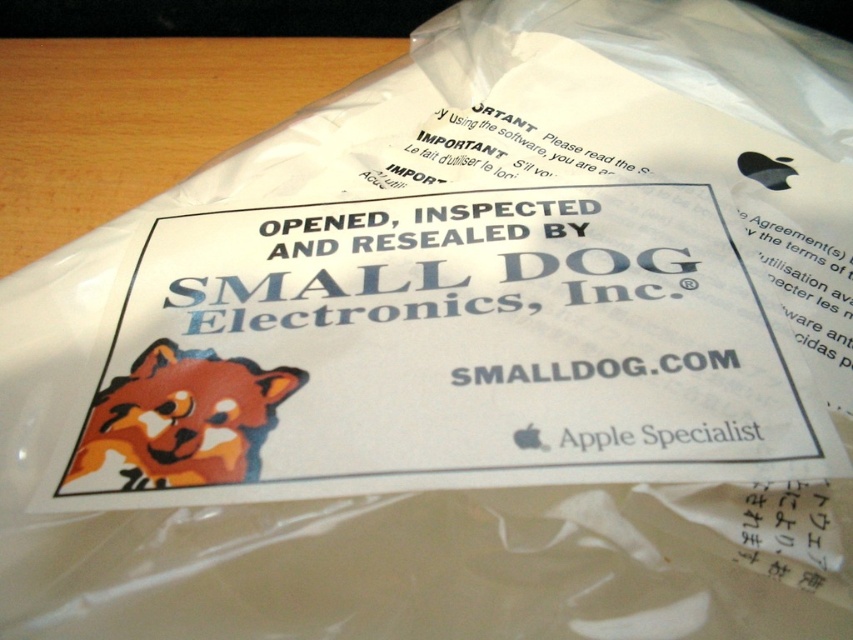
Which is in front, point (115, 173) or point (146, 372)?

Point (146, 372) is more forward.

Between wooden table at upper left and orange fur dog at center, which one appears on the right side from the viewer's perspective?

orange fur dog at center

Does point (59, 140) lie behind point (178, 404)?

Yes, it is behind point (178, 404).

The height and width of the screenshot is (640, 853). Identify the location of wooden table at upper left. (141, 118).